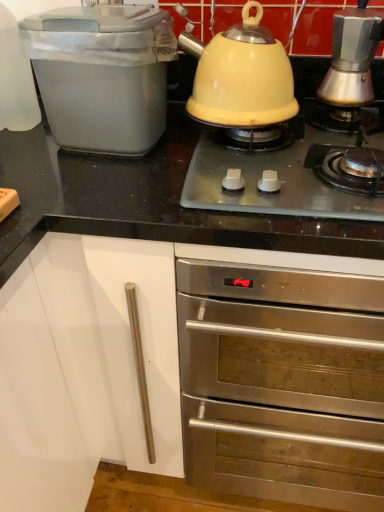
Where is `stainless steel oven at upper center`? The width and height of the screenshot is (384, 512). stainless steel oven at upper center is located at coordinates (282, 383).

This screenshot has width=384, height=512. Identify the location of silver metallic espresso maker at upper right, the second kitchen appliance viewed from the left. (352, 56).

Describe the element at coordinates (102, 75) in the screenshot. I see `matte plastic bread bin at left, acting as the 2th kitchen appliance starting from the right` at that location.

I want to click on stainless steel oven at upper center, so click(x=282, y=383).

From the image's perspective, would you say yellow enameled kettle at upper center is positioned over matte plastic bread bin at left, acting as the 2th kitchen appliance starting from the right?

No, from the image's perspective, yellow enameled kettle at upper center is not over matte plastic bread bin at left, acting as the 2th kitchen appliance starting from the right.

From a real-world perspective, who is located higher, yellow enameled kettle at upper center or matte plastic bread bin at left, the 1th kitchen appliance viewed from the left?

In real-world perspective, matte plastic bread bin at left, the 1th kitchen appliance viewed from the left, is above.

There is a yellow enameled kettle at upper center. Where is `the 1st kitchen appliance above it (from the image's perspective)`? the 1st kitchen appliance above it (from the image's perspective) is located at coordinates (102, 75).

Find the location of `kettle to the left of silver metallic espresso maker at upper right, the second kitchen appliance viewed from the left`. kettle to the left of silver metallic espresso maker at upper right, the second kitchen appliance viewed from the left is located at coordinates (241, 76).

Is yellow matte kettle at center surrounding silver metallic espresso maker at upper right, the second kitchen appliance viewed from the left?

No, silver metallic espresso maker at upper right, the second kitchen appliance viewed from the left, is located outside of yellow matte kettle at center.

Does yellow matte kettle at center lie in front of silver metallic espresso maker at upper right, the 1th kitchen appliance viewed from the right?

Yes, yellow matte kettle at center is in front of silver metallic espresso maker at upper right, the 1th kitchen appliance viewed from the right.

Is point (241, 45) farther from camera compared to point (369, 32)?

No, (241, 45) is closer to viewer.

Is silver metallic espresso maker at upper right, the 1th kitchen appliance viewed from the right, located outside stainless steel oven at upper center?

Yes.

Is stainless steel oven at upper center at the back of silver metallic espresso maker at upper right, the second kitchen appliance viewed from the left?

No, silver metallic espresso maker at upper right, the second kitchen appliance viewed from the left,'s orientation is not away from stainless steel oven at upper center.

Can you see yellow enameled kettle at upper center touching stainless steel oven at upper center?

No, yellow enameled kettle at upper center is not in contact with stainless steel oven at upper center.

Is point (371, 205) farther from viewer compared to point (232, 297)?

No.

In terms of width, does yellow enameled kettle at upper center look wider or thinner when compared to stainless steel oven at upper center?

yellow enameled kettle at upper center is thinner than stainless steel oven at upper center.

Consider the image. Between stainless steel oven at upper center and matte plastic bread bin at left, acting as the 2th kitchen appliance starting from the right, which one appears on the left side from the viewer's perspective?

Positioned to the left is matte plastic bread bin at left, acting as the 2th kitchen appliance starting from the right.

From a real-world perspective, does stainless steel oven at upper center sit lower than matte plastic bread bin at left, acting as the 2th kitchen appliance starting from the right?

Yes, from a real-world perspective, stainless steel oven at upper center is beneath matte plastic bread bin at left, acting as the 2th kitchen appliance starting from the right.

Does stainless steel oven at upper center have a larger size compared to matte plastic bread bin at left, the 1th kitchen appliance viewed from the left?

Yes, stainless steel oven at upper center is bigger than matte plastic bread bin at left, the 1th kitchen appliance viewed from the left.

Consider the image. From the image's perspective, is stainless steel oven at upper center positioned above or below matte plastic bread bin at left, the 1th kitchen appliance viewed from the left?

From the image's perspective, stainless steel oven at upper center appears below matte plastic bread bin at left, the 1th kitchen appliance viewed from the left.

Considering the sizes of matte plastic bread bin at left, the 1th kitchen appliance viewed from the left, and yellow enameled kettle at upper center in the image, is matte plastic bread bin at left, the 1th kitchen appliance viewed from the left, bigger or smaller than yellow enameled kettle at upper center?

matte plastic bread bin at left, the 1th kitchen appliance viewed from the left, is smaller than yellow enameled kettle at upper center.

From a real-world perspective, does matte plastic bread bin at left, acting as the 2th kitchen appliance starting from the right, stand above yellow enameled kettle at upper center?

Correct, in the physical world, matte plastic bread bin at left, acting as the 2th kitchen appliance starting from the right, is higher than yellow enameled kettle at upper center.

Does matte plastic bread bin at left, the 1th kitchen appliance viewed from the left, have a lesser width compared to yellow enameled kettle at upper center?

Indeed, matte plastic bread bin at left, the 1th kitchen appliance viewed from the left, has a lesser width compared to yellow enameled kettle at upper center.

Considering the sizes of objects matte plastic bread bin at left, the 1th kitchen appliance viewed from the left, and yellow enameled kettle at upper center in the image provided, who is shorter, matte plastic bread bin at left, the 1th kitchen appliance viewed from the left, or yellow enameled kettle at upper center?

yellow enameled kettle at upper center.

Can you confirm if yellow enameled kettle at upper center is positioned to the left of silver metallic espresso maker at upper right, the 1th kitchen appliance viewed from the right?

Yes.

Is yellow enameled kettle at upper center thinner than silver metallic espresso maker at upper right, the 1th kitchen appliance viewed from the right?

No.

Consider the image. Is silver metallic espresso maker at upper right, the second kitchen appliance viewed from the left, at the back of yellow enameled kettle at upper center?

yellow enameled kettle at upper center is not turned away from silver metallic espresso maker at upper right, the second kitchen appliance viewed from the left.

Locate an element on the screen. the 2nd kitchen appliance behind the yellow enameled kettle at upper center, starting your count from the anchor is located at coordinates (352, 56).

Locate an element on the screen. gas stove located on the right of matte plastic bread bin at left, the 1th kitchen appliance viewed from the left is located at coordinates (279, 180).

From a real-world perspective, starting from the yellow matte kettle at center, which kitchen appliance is the 1st one below it? Please provide its 2D coordinates.

[(352, 56)]

Considering their positions, is yellow enameled kettle at upper center positioned closer to yellow matte kettle at center than silver metallic espresso maker at upper right, the second kitchen appliance viewed from the left?

Based on the image, yellow enameled kettle at upper center appears to be nearer to yellow matte kettle at center.

Looking at the image, which one is located further to yellow matte kettle at center, silver metallic espresso maker at upper right, the second kitchen appliance viewed from the left, or yellow enameled kettle at upper center?

silver metallic espresso maker at upper right, the second kitchen appliance viewed from the left.

Looking at this image, estimate the real-world distances between objects in this image. Which object is closer to yellow enameled kettle at upper center, silver metallic espresso maker at upper right, the second kitchen appliance viewed from the left, or stainless steel oven at upper center?

Based on the image, silver metallic espresso maker at upper right, the second kitchen appliance viewed from the left, appears to be nearer to yellow enameled kettle at upper center.

Based on their spatial positions, is silver metallic espresso maker at upper right, the 1th kitchen appliance viewed from the right, or matte plastic bread bin at left, the 1th kitchen appliance viewed from the left, closer to yellow enameled kettle at upper center?

matte plastic bread bin at left, the 1th kitchen appliance viewed from the left, lies closer to yellow enameled kettle at upper center than the other object.

Estimate the real-world distances between objects in this image. Which object is further from silver metallic espresso maker at upper right, the 1th kitchen appliance viewed from the right, yellow enameled kettle at upper center or yellow matte kettle at center?

yellow enameled kettle at upper center is further to silver metallic espresso maker at upper right, the 1th kitchen appliance viewed from the right.

In the scene shown: Considering their positions, is yellow matte kettle at center positioned closer to yellow enameled kettle at upper center than silver metallic espresso maker at upper right, the second kitchen appliance viewed from the left?

Based on the image, yellow matte kettle at center appears to be nearer to yellow enameled kettle at upper center.

In the scene shown: From the image, which object appears to be nearer to silver metallic espresso maker at upper right, the 1th kitchen appliance viewed from the right, matte plastic bread bin at left, acting as the 2th kitchen appliance starting from the right, or yellow enameled kettle at upper center?

yellow enameled kettle at upper center is closer to silver metallic espresso maker at upper right, the 1th kitchen appliance viewed from the right.

Based on their spatial positions, is yellow matte kettle at center or silver metallic espresso maker at upper right, the 1th kitchen appliance viewed from the right, closer to matte plastic bread bin at left, the 1th kitchen appliance viewed from the left?

yellow matte kettle at center is positioned closer to the anchor matte plastic bread bin at left, the 1th kitchen appliance viewed from the left.

The height and width of the screenshot is (512, 384). Identify the location of gas stove between silver metallic espresso maker at upper right, the second kitchen appliance viewed from the left, and stainless steel oven at upper center in the up-down direction. (279, 180).

Find the location of a particular element. The height and width of the screenshot is (512, 384). gas stove between yellow matte kettle at center and stainless steel oven at upper center in the up-down direction is located at coordinates (279, 180).

In order to click on kitchen appliance between yellow matte kettle at center and stainless steel oven at upper center from top to bottom in this screenshot , I will do `click(102, 75)`.

Find the location of a particular element. The width and height of the screenshot is (384, 512). kettle between matte plastic bread bin at left, acting as the 2th kitchen appliance starting from the right, and yellow enameled kettle at upper center from left to right is located at coordinates (241, 76).